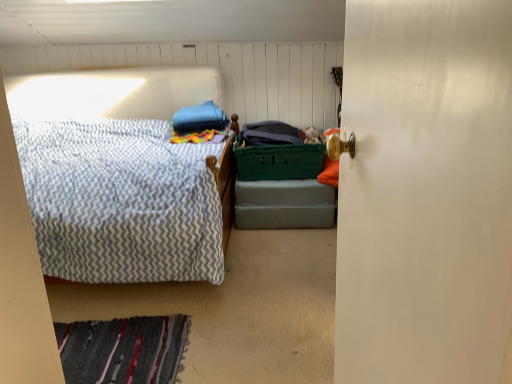
Question: Could you tell me if green plastic crate at center is turned towards green plastic laundry basket at center?

Choices:
 (A) yes
 (B) no

Answer: (B)

Question: Is green plastic crate at center facing away from green plastic laundry basket at center?

Choices:
 (A) no
 (B) yes

Answer: (A)

Question: Is green plastic crate at center taller than green plastic laundry basket at center?

Choices:
 (A) yes
 (B) no

Answer: (B)

Question: From a real-world perspective, is green plastic crate at center positioned over green plastic laundry basket at center based on gravity?

Choices:
 (A) yes
 (B) no

Answer: (B)

Question: Considering the relative sizes of green plastic crate at center and green plastic laundry basket at center in the image provided, is green plastic crate at center shorter than green plastic laundry basket at center?

Choices:
 (A) no
 (B) yes

Answer: (B)

Question: In terms of size, does green plastic laundry basket at center appear bigger or smaller than striped wool rug at lower left?

Choices:
 (A) small
 (B) big

Answer: (B)

Question: Do you think green plastic laundry basket at center is within striped wool rug at lower left, or outside of it?

Choices:
 (A) outside
 (B) inside

Answer: (A)

Question: Is green plastic laundry basket at center wider or thinner than striped wool rug at lower left?

Choices:
 (A) wide
 (B) thin

Answer: (B)

Question: From a real-world perspective, relative to striped wool rug at lower left, is green plastic laundry basket at center vertically above or below?

Choices:
 (A) below
 (B) above

Answer: (B)

Question: Is green plastic crate at center bigger or smaller than striped wool rug at lower left?

Choices:
 (A) small
 (B) big

Answer: (B)

Question: Is green plastic crate at center to the left or to the right of striped wool rug at lower left in the image?

Choices:
 (A) right
 (B) left

Answer: (A)

Question: Is green plastic crate at center inside the boundaries of striped wool rug at lower left, or outside?

Choices:
 (A) inside
 (B) outside

Answer: (B)

Question: In the image, is green plastic crate at center positioned in front of or behind striped wool rug at lower left?

Choices:
 (A) front
 (B) behind

Answer: (B)

Question: Looking at their shapes, would you say striped wool rug at lower left is wider or thinner than white glossy door at right?

Choices:
 (A) wide
 (B) thin

Answer: (A)

Question: In the image, is striped wool rug at lower left on the left side or the right side of white glossy door at right?

Choices:
 (A) left
 (B) right

Answer: (A)